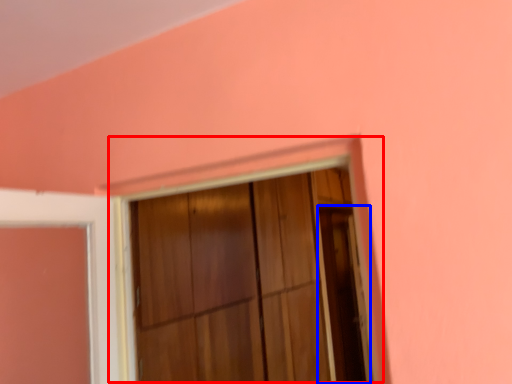
Question: Which of the following is the farthest to the observer, window frame (highlighted by a red box) or screen door (highlighted by a blue box)?

Choices:
 (A) window frame
 (B) screen door

Answer: (B)